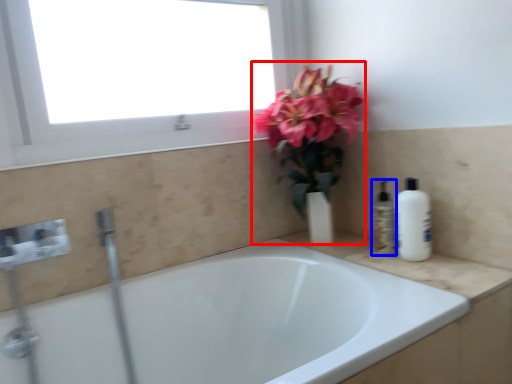
Question: Which point is further to the camera, floral arrangement (highlighted by a red box) or toiletry (highlighted by a blue box)?

Choices:
 (A) floral arrangement
 (B) toiletry

Answer: (B)